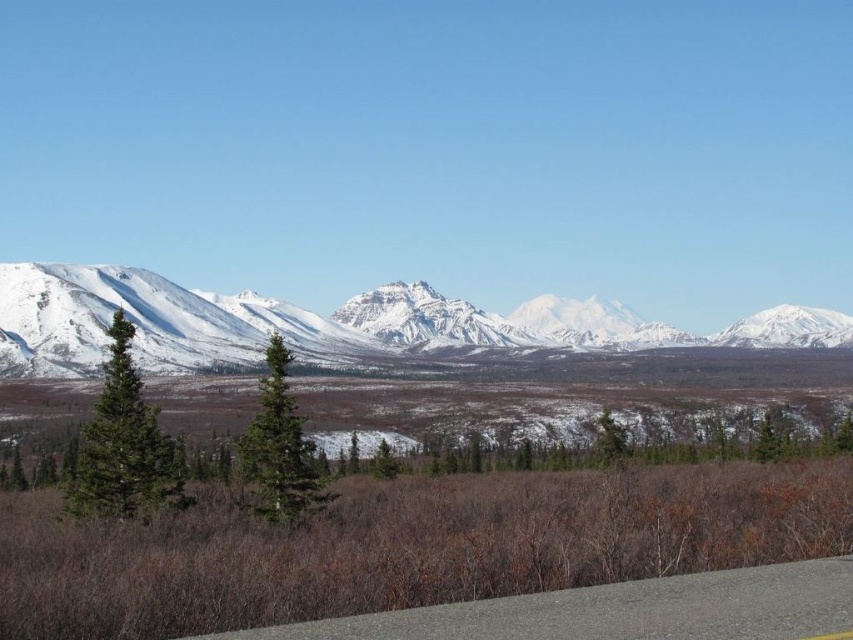
You are a hiker planning to take a photo of the snowy granite mountains at center from the gray asphalt road at lower center. Which direction should you face to capture the mountains in your shot?

The snowy granite mountains at center are to the right of the gray asphalt road at lower center, so you should face to the right direction from the road to capture them in your photo.

You are planning a hiking route and need to cross the gray asphalt road at lower center to reach the snowy granite mountains at center. Based on the image, is the road directly below the mountains?

Yes, the snowy granite mountains at center are located above the gray asphalt road at lower center, so the road is directly below the mountains.

You are standing in the open landscape and want to take a photo of the snowy granite mountains at center. Where should you position yourself to ensure they are centered in your camera viewfinder?

To center the snowy granite mountains at center in your camera viewfinder, position yourself directly in front of them at point (315, 324).